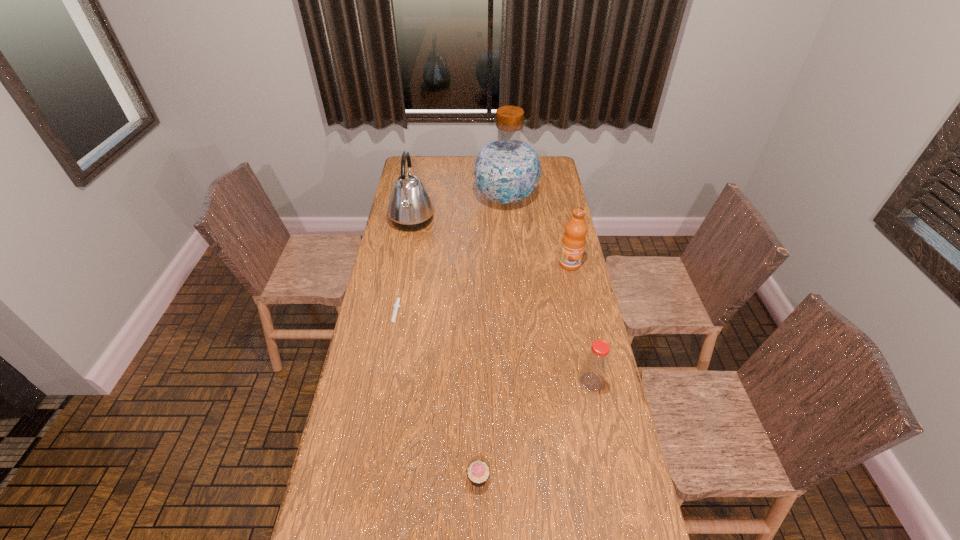
I want to click on bottle at the right edge, so click(x=595, y=365).

The width and height of the screenshot is (960, 540). In the image, there is a desktop. In order to click on vacant space at the left edge in this screenshot , I will do `click(363, 440)`.

Locate an element on the screen. The width and height of the screenshot is (960, 540). vacant area at the right edge of the desktop is located at coordinates (553, 251).

I want to click on free space between the third farthest object and the cupcake, so click(x=524, y=371).

Where is `free space between the water jug and the syringe`? free space between the water jug and the syringe is located at coordinates (451, 257).

Identify the location of vacant area between the fruit juice and the fifth shortest object. coord(491,242).

Find the location of a particular element. Image resolution: width=960 pixels, height=540 pixels. empty space between the bottle and the tallest object is located at coordinates (548, 290).

Find the location of `free spot between the second shortest object and the fourth tallest object`. free spot between the second shortest object and the fourth tallest object is located at coordinates (535, 430).

I want to click on vacant area between the syringe and the second shortest object, so click(437, 397).

At what (x,y) coordinates should I click in order to perform the action: click on vacant area that lies between the tallest object and the bottle. Please return your answer as a coordinate pair (x, y). The height and width of the screenshot is (540, 960). Looking at the image, I should click on (548, 290).